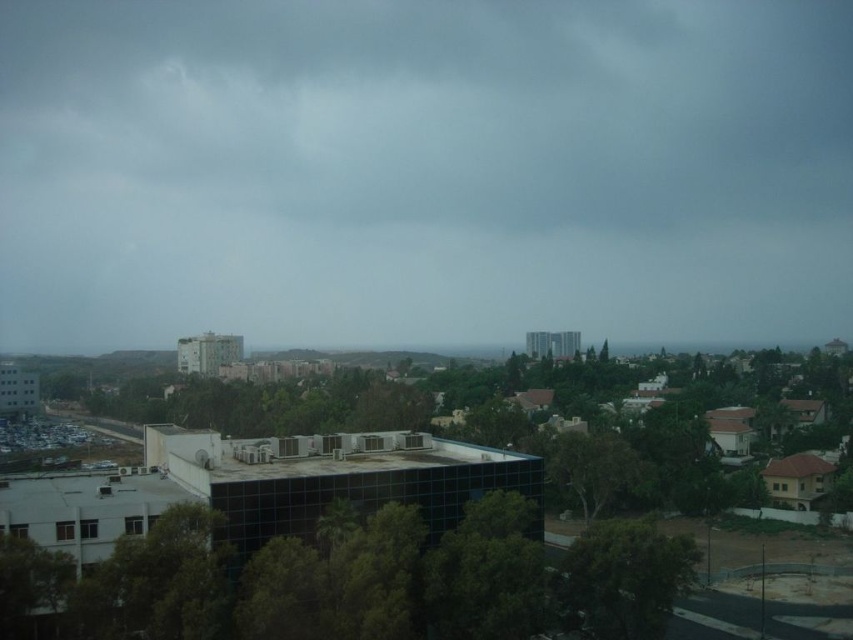
The width and height of the screenshot is (853, 640). Describe the element at coordinates (424, 170) in the screenshot. I see `dark gray cloud at upper center` at that location.

Locate an element on the screen. Image resolution: width=853 pixels, height=640 pixels. dark gray cloud at upper center is located at coordinates (424, 170).

Does green leafy tree at center appear under green leafy tree at lower right?

Incorrect, green leafy tree at center is not positioned below green leafy tree at lower right.

Can you confirm if green leafy tree at center is positioned to the right of green leafy tree at lower right?

No, green leafy tree at center is not to the right of green leafy tree at lower right.

Locate an element on the screen. Image resolution: width=853 pixels, height=640 pixels. green leafy tree at center is located at coordinates (354, 580).

Locate an element on the screen. green leafy tree at center is located at coordinates (354, 580).

Does point (16, 35) lie in front of point (598, 595)?

No, it is not.

Does dark gray cloud at upper center appear under green leafy tree at lower right?

Incorrect, dark gray cloud at upper center is not positioned below green leafy tree at lower right.

This screenshot has height=640, width=853. What do you see at coordinates (424, 170) in the screenshot?
I see `dark gray cloud at upper center` at bounding box center [424, 170].

Where is `dark gray cloud at upper center`? dark gray cloud at upper center is located at coordinates (424, 170).